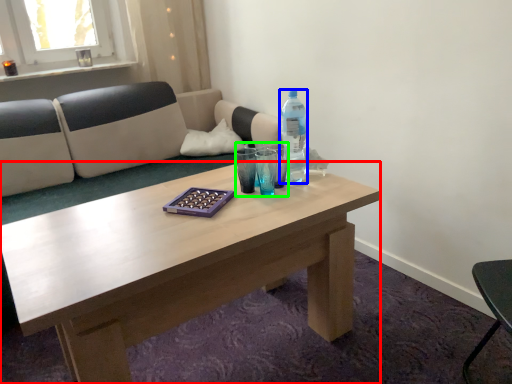
Question: Which object is the closest to the coffee table (highlighted by a red box)? Choose among these: bottle (highlighted by a blue box) or mineral water (highlighted by a green box).

Choices:
 (A) bottle
 (B) mineral water

Answer: (B)